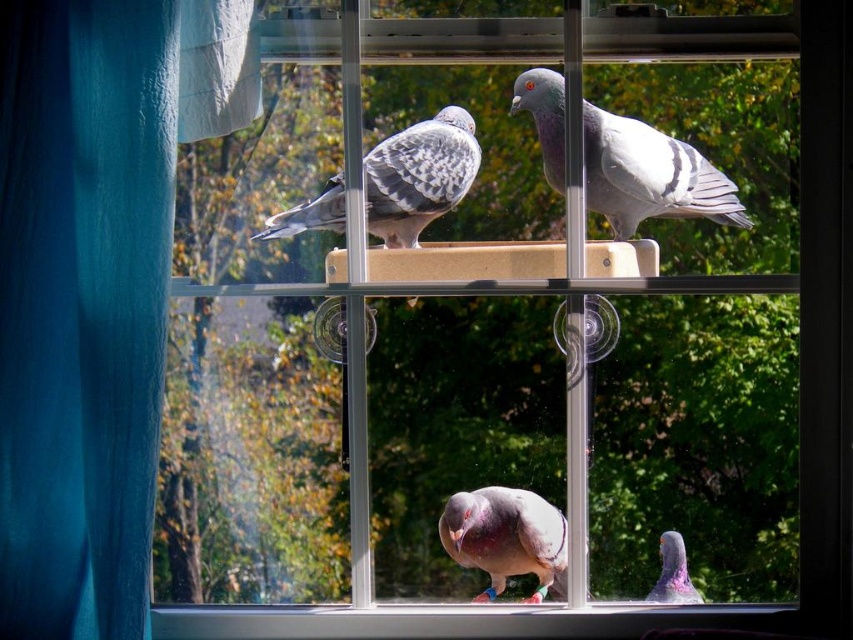
Does speckled feathered pigeon at upper left appear under pinkish-gray feathered pigeon at lower center?

Actually, speckled feathered pigeon at upper left is above pinkish-gray feathered pigeon at lower center.

How much distance is there between speckled feathered pigeon at upper left and pinkish-gray feathered pigeon at lower center?

They are 9.06 inches apart.

What do you see at coordinates (419, 176) in the screenshot? This screenshot has width=853, height=640. I see `speckled feathered pigeon at upper left` at bounding box center [419, 176].

Find the location of a particular element. The width and height of the screenshot is (853, 640). speckled feathered pigeon at upper left is located at coordinates (419, 176).

Between teal fabric curtain at left and purple-gray pigeon at lower right, which one is positioned lower?

Positioned lower is purple-gray pigeon at lower right.

Is teal fabric curtain at left above purple-gray pigeon at lower right?

Indeed, teal fabric curtain at left is positioned over purple-gray pigeon at lower right.

Is point (80, 173) in front of point (674, 576)?

Yes, point (80, 173) is in front of point (674, 576).

Where is `teal fabric curtain at left`? teal fabric curtain at left is located at coordinates (94, 285).

Which is above, gray speckled pigeon at upper center or purple-gray pigeon at lower right?

gray speckled pigeon at upper center is higher up.

Does point (595, 150) come closer to viewer compared to point (659, 593)?

That is True.

This screenshot has width=853, height=640. I want to click on gray speckled pigeon at upper center, so click(650, 176).